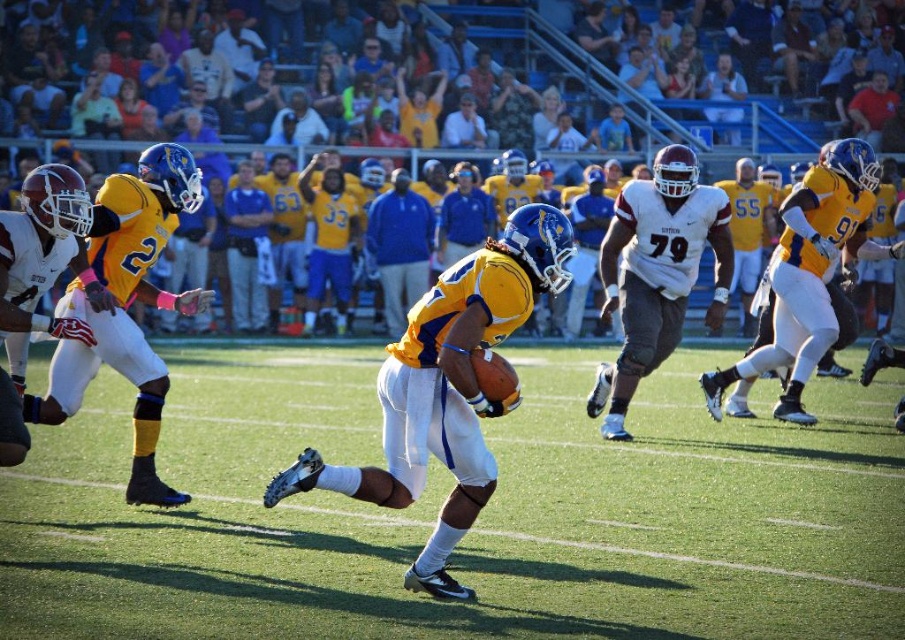
Question: Does white matte jersey at center have a lesser width compared to blue jersey at center?

Choices:
 (A) no
 (B) yes

Answer: (A)

Question: Can you confirm if yellow matte jersey at center is bigger than blue jersey at center?

Choices:
 (A) yes
 (B) no

Answer: (A)

Question: Estimate the real-world distances between objects in this image. Which object is farther from the green grass football field at center?

Choices:
 (A) white matte jersey at center
 (B) matte yellow jersey at center
 (C) yellow jersey at center

Answer: (C)

Question: Which point is closer to the camera taking this photo?

Choices:
 (A) (243, 289)
 (B) (397, 452)
 (C) (656, 189)

Answer: (B)

Question: Can you confirm if yellow matte jersey at center is positioned above white matte jersey at center?

Choices:
 (A) no
 (B) yes

Answer: (A)

Question: Which of the following is the farthest from the observer?

Choices:
 (A) [x=780, y=419]
 (B) [x=450, y=288]
 (C) [x=650, y=266]

Answer: (A)